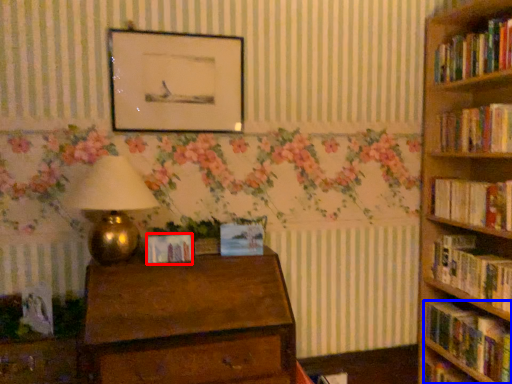
Question: Which object is further to the camera taking this photo, paperback book (highlighted by a red box) or book (highlighted by a blue box)?

Choices:
 (A) paperback book
 (B) book

Answer: (A)